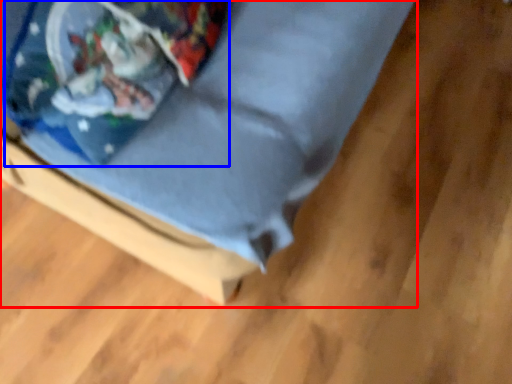
Question: Which of the following is the farthest to the observer, furniture (highlighted by a red box) or wrapping paper (highlighted by a blue box)?

Choices:
 (A) furniture
 (B) wrapping paper

Answer: (B)